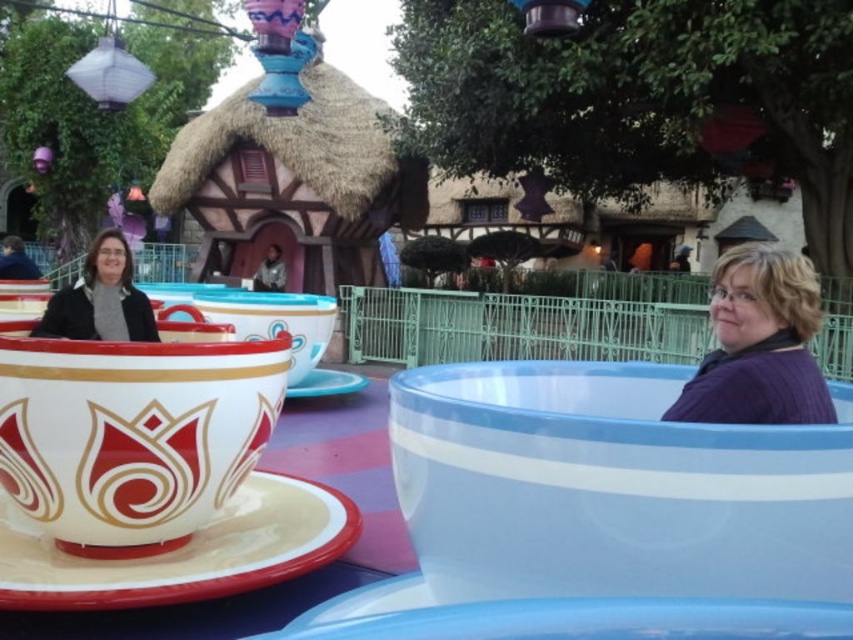
Question: Which object is closer to the camera taking this photo?

Choices:
 (A) white glossy saucer at center
 (B) purple knit sweater at right

Answer: (B)

Question: Is matte white teacup at center thinner than white glossy saucer at center?

Choices:
 (A) yes
 (B) no

Answer: (B)

Question: Estimate the real-world distances between objects in this image. Which object is closer to the purple knit sweater at right?

Choices:
 (A) white glossy saucer at center
 (B) matte black sweater at left
 (C) matte white teacup at center

Answer: (C)

Question: Can you confirm if matte white teacup at center is smaller than matte white saucer at lower left?

Choices:
 (A) yes
 (B) no

Answer: (B)

Question: Can you confirm if matte black sweater at left is bigger than white glossy saucer at center?

Choices:
 (A) no
 (B) yes

Answer: (A)

Question: Which point appears closest to the camera in this image?

Choices:
 (A) (354, 388)
 (B) (131, 314)
 (C) (341, 529)
 (D) (779, 253)

Answer: (D)